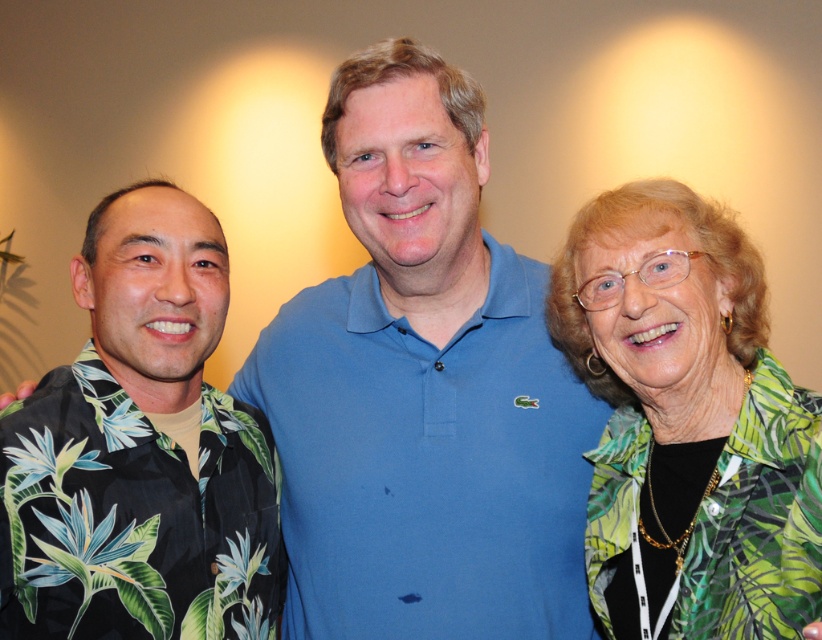
You are a photographer adjusting the camera settings to ensure all subjects are in focus. Considering the black floral shirt at left and the green leafy blouse at right, which one should you prioritize focusing on first to ensure proper depth of field?

The black floral shirt at left should be prioritized for focusing first because it occupies less space, allowing the photographer to adjust the depth of field to include both subjects effectively.

In the scene described, there are two men posing for a photo. One is wearing a black floral shirt at left and the other a blue polo shirt in the center. Where is the point located at coordinates (141, 452) in relation to these two men?

The point at coordinates (141, 452) corresponds to the black floral shirt at left, as stated in the objects description.

Looking at this image, you are a photographer trying to adjust the lighting for a photo shoot. You notice the black floral shirt at left and the green leafy blouse at right. Which clothing item is positioned more to the left side of the frame?

The black floral shirt at left is positioned more to the left side of the frame than the green leafy blouse at right.